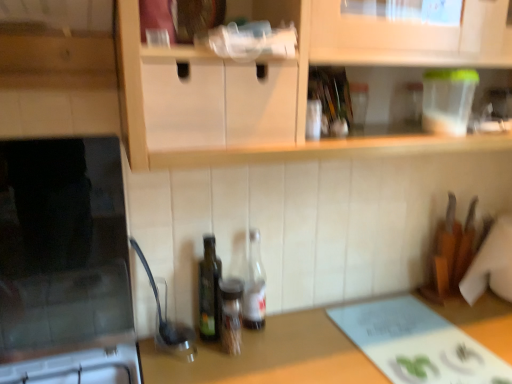
Find the location of a particular element. vacant space situated on the left part of translucent glass spice jar at center, which is the second bottle from right to left is located at coordinates (177, 357).